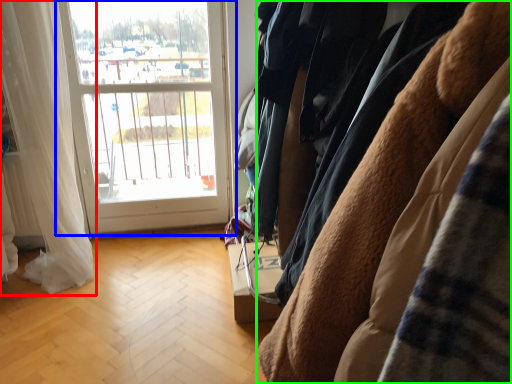
Question: Estimate the real-world distances between objects in this image. Which object is closer to curtain (highlighted by a red box), window (highlighted by a blue box) or furniture (highlighted by a green box)?

Choices:
 (A) window
 (B) furniture

Answer: (A)